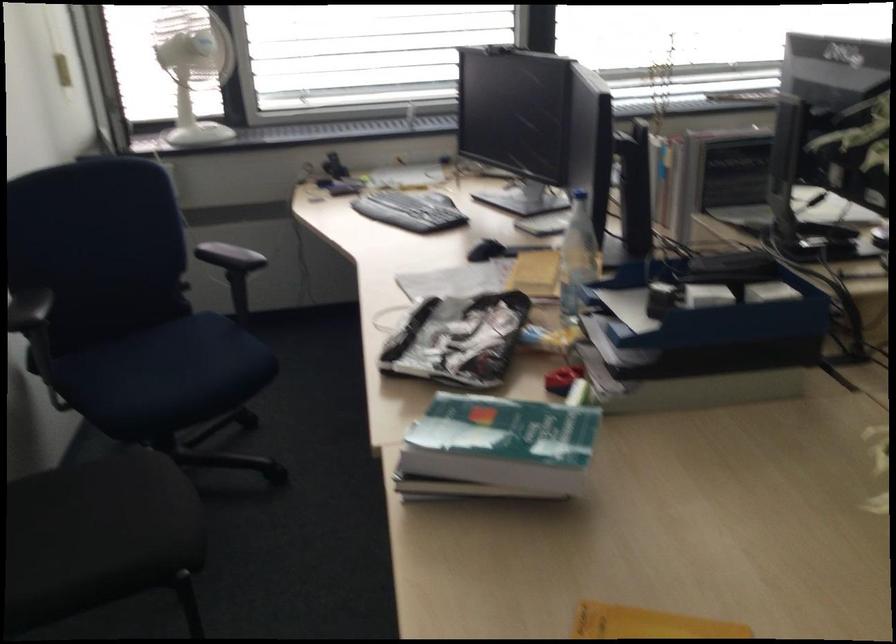
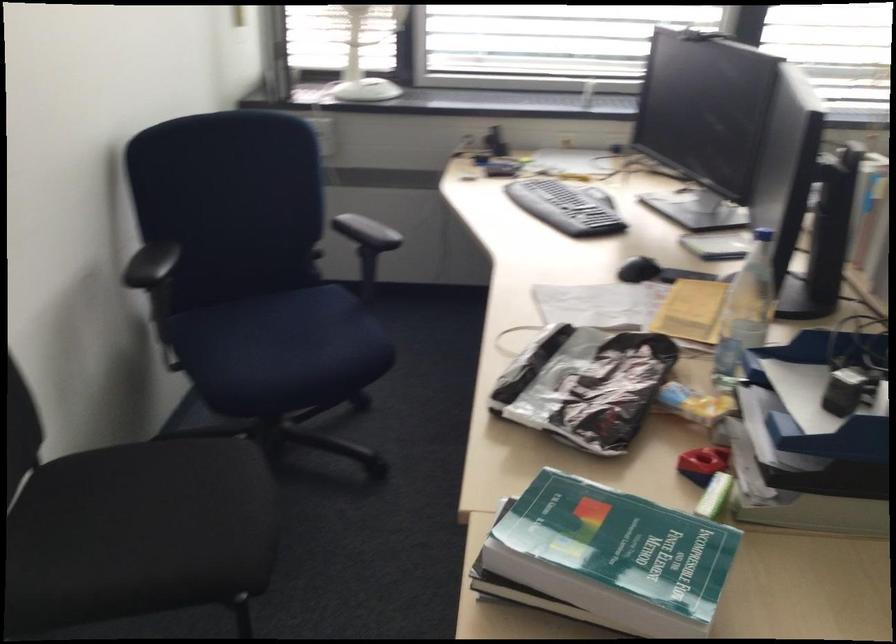
Where in the second image is the point corresponding to point (485, 252) from the first image?

(639, 269)